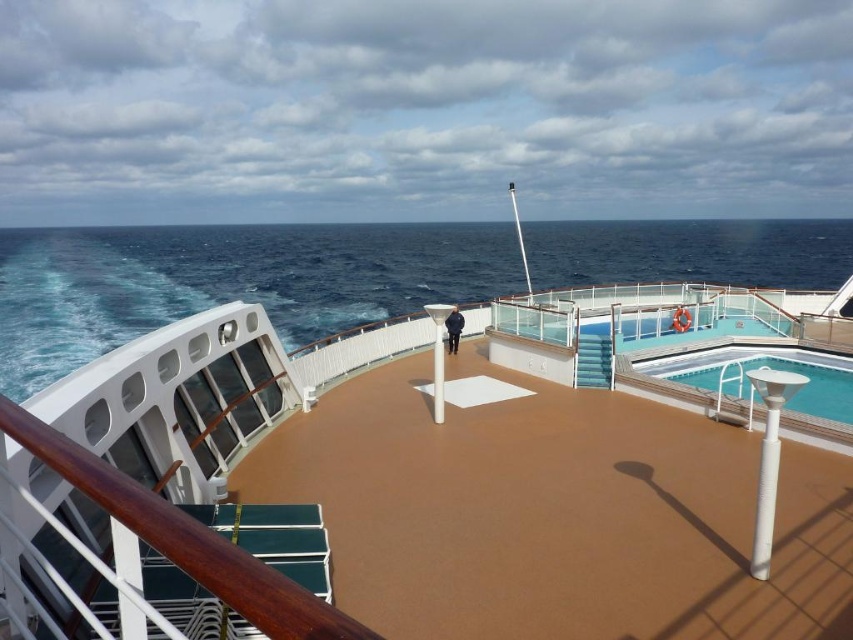
You are a maintenance worker on the cruise ship deck. You need to transport a large equipment that requires a surface wider than 3 meters. Based on the deck layout, can you determine if the brown rubber deck at center is wider than the blue glossy pool at upper right?

The brown rubber deck at center might be wider than blue glossy pool at upper right, so there is a possibility that it can accommodate the equipment. However, without exact measurements, it is uncertain. Please verify the dimensions before proceeding.

You are standing on the cruise ship deck and want to go to the blue water at upper left. Which direction should you move relative to the brown rubber deck at center?

The blue water at upper left is positioned on the right side of the brown rubber deck at center, so you should move to the right of the brown rubber deck at center to reach the blue water at upper left.